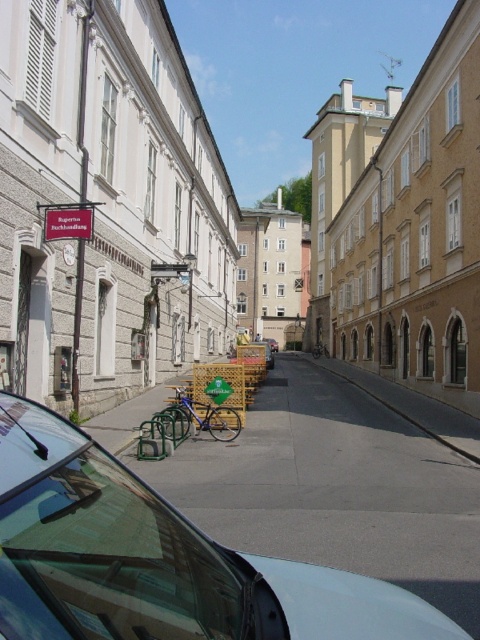
Which of these two, metallic silver car at center or brown textured building at right, stands shorter?

With less height is metallic silver car at center.

Between metallic silver car at center and brown textured building at right, which one has more height?

brown textured building at right

Between point (155, 605) and point (462, 404), which one is positioned in front?

Point (155, 605) is more forward.

In order to click on metallic silver car at center in this screenshot , I will do `click(156, 557)`.